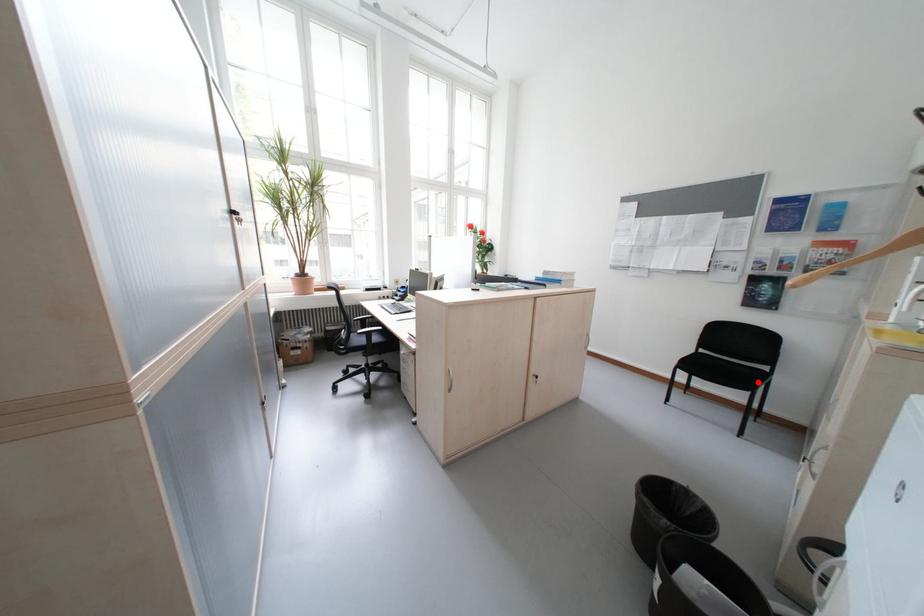
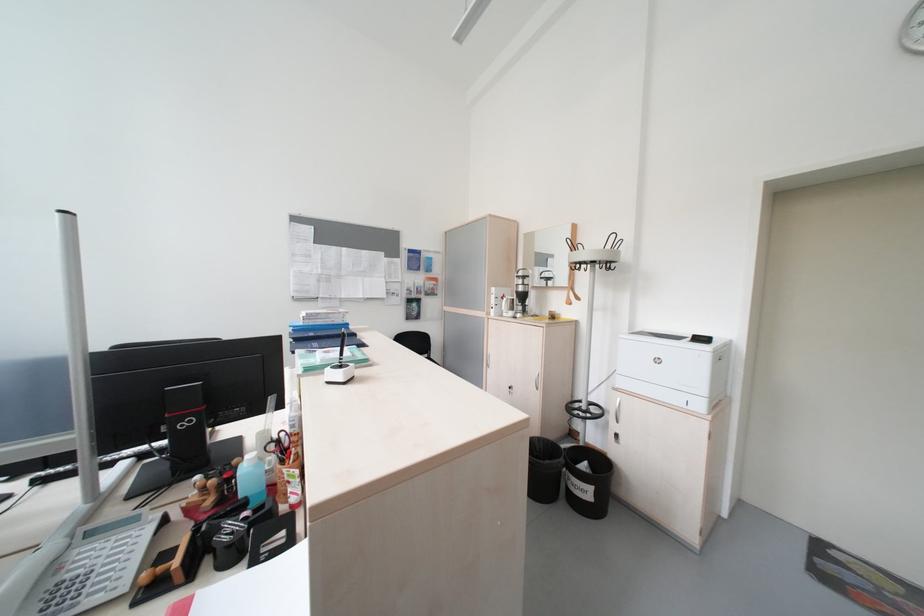
Question: I am providing you with two images of the same scene from different viewpoints. A red point is marked on the first image. At the location where the point appears in image 1, is it still visible in image 2?

Choices:
 (A) Yes
 (B) No

Answer: (B)